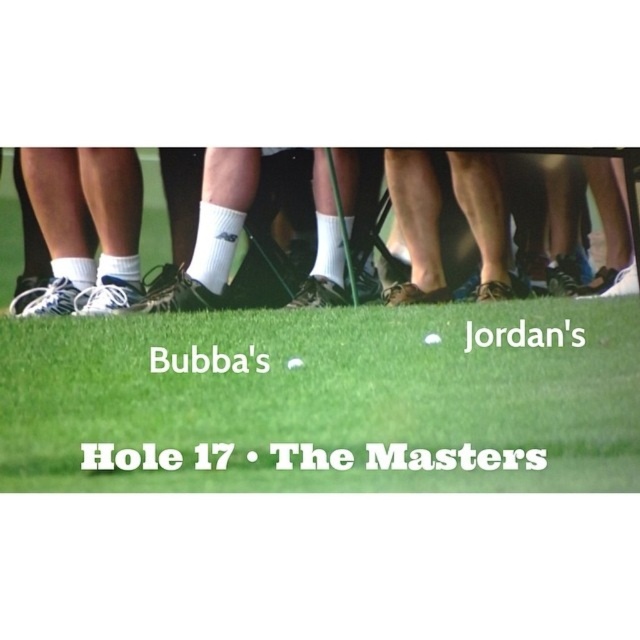
Question: Does white smooth golf ball at center appear on the right side of white matte golf ball at center?

Choices:
 (A) yes
 (B) no

Answer: (A)

Question: Which point is farther from the camera taking this photo?

Choices:
 (A) [289, 368]
 (B) [541, 403]

Answer: (A)

Question: Which point is farther to the camera?

Choices:
 (A) (269, 310)
 (B) (298, 364)

Answer: (A)

Question: Does white smooth golf ball at center come in front of white matte golf ball at center?

Choices:
 (A) yes
 (B) no

Answer: (A)

Question: Is white smooth golf ball at center above white matte golf ball at center?

Choices:
 (A) no
 (B) yes

Answer: (A)